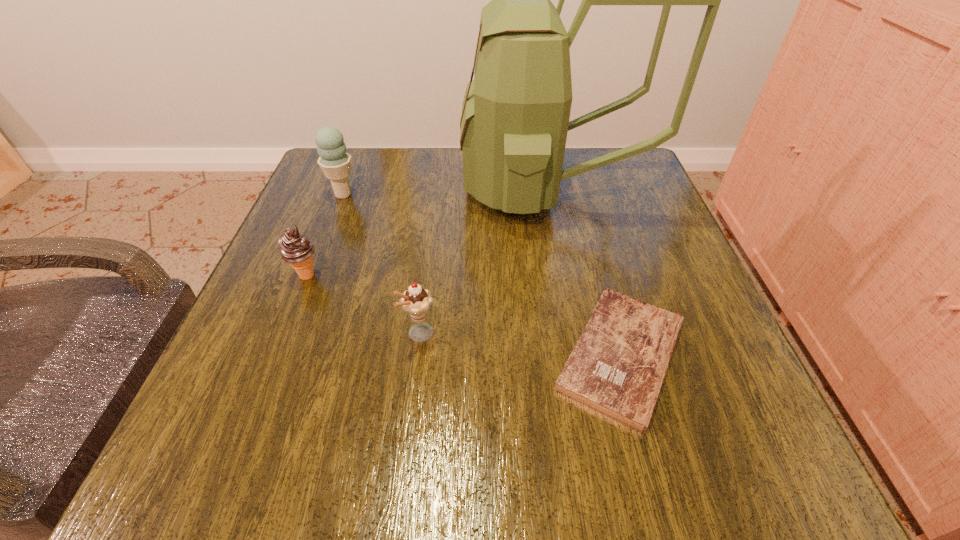
Identify the location of backpack. (515, 116).

This screenshot has width=960, height=540. I want to click on the tallest icecream, so click(335, 162).

At what (x,y) coordinates should I click in order to perform the action: click on the second tallest object. Please return your answer as a coordinate pair (x, y). The image size is (960, 540). Looking at the image, I should click on (335, 162).

Locate an element on the screen. the nearest icecream is located at coordinates (416, 301).

Identify the location of the third object from right to left. The height and width of the screenshot is (540, 960). (416, 301).

This screenshot has height=540, width=960. Find the location of `the third farthest object`. the third farthest object is located at coordinates (296, 249).

Locate an element on the screen. The width and height of the screenshot is (960, 540). the shortest object is located at coordinates (617, 367).

Locate an element on the screen. Image resolution: width=960 pixels, height=540 pixels. vacant space located 0.250m on the front pocket of the tallest object is located at coordinates (352, 190).

Where is `blank area located 0.150m on the front pocket of the tallest object`? This screenshot has width=960, height=540. blank area located 0.150m on the front pocket of the tallest object is located at coordinates (396, 190).

Locate an element on the screen. free space located on the front pocket of the tallest object is located at coordinates (326, 190).